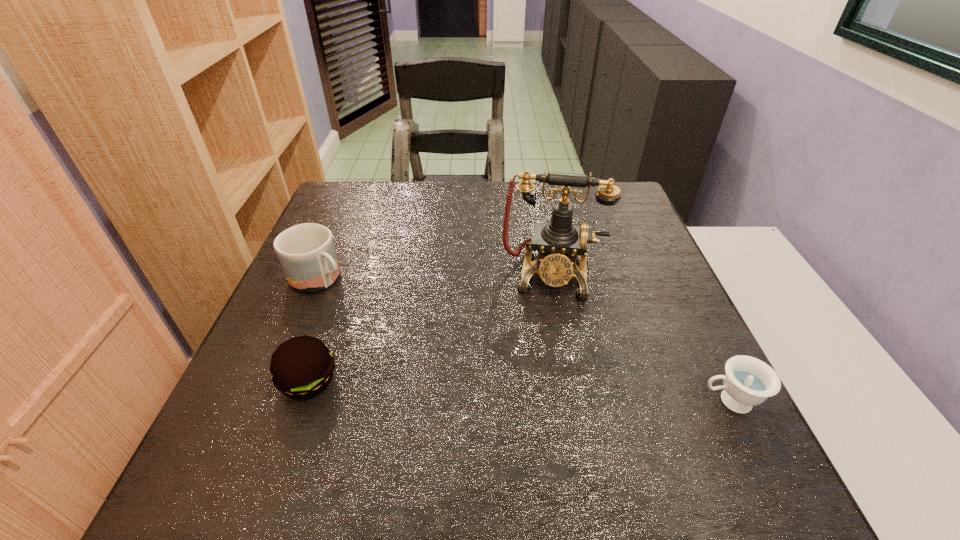
Where is `teacup that is at the right edge`? The height and width of the screenshot is (540, 960). teacup that is at the right edge is located at coordinates (748, 381).

Locate an element on the screen. This screenshot has height=540, width=960. telephone present at the right edge is located at coordinates (559, 242).

Identify the location of object situated at the near left corner. The image size is (960, 540). (302, 367).

This screenshot has height=540, width=960. Find the location of `object that is at the near right corner`. object that is at the near right corner is located at coordinates (748, 381).

Identify the location of vacant space at the far edge of the desktop. The width and height of the screenshot is (960, 540). (461, 222).

Where is `vacant space at the near edge of the desktop`? Image resolution: width=960 pixels, height=540 pixels. vacant space at the near edge of the desktop is located at coordinates (560, 418).

Where is `free point at the left edge`? The image size is (960, 540). free point at the left edge is located at coordinates (297, 296).

Where is `vacant position at the right edge of the desktop`? This screenshot has width=960, height=540. vacant position at the right edge of the desktop is located at coordinates (659, 262).

This screenshot has height=540, width=960. I want to click on free space at the far left corner of the desktop, so click(348, 202).

At what (x,y) coordinates should I click in order to perform the action: click on vacant area at the near left corner. Please return your answer as a coordinate pair (x, y). The height and width of the screenshot is (540, 960). Looking at the image, I should click on (304, 438).